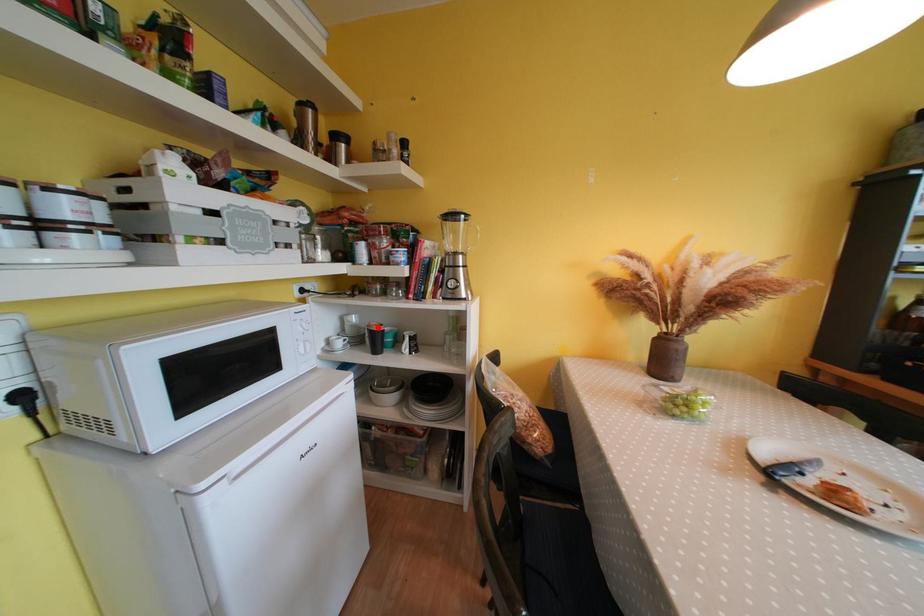
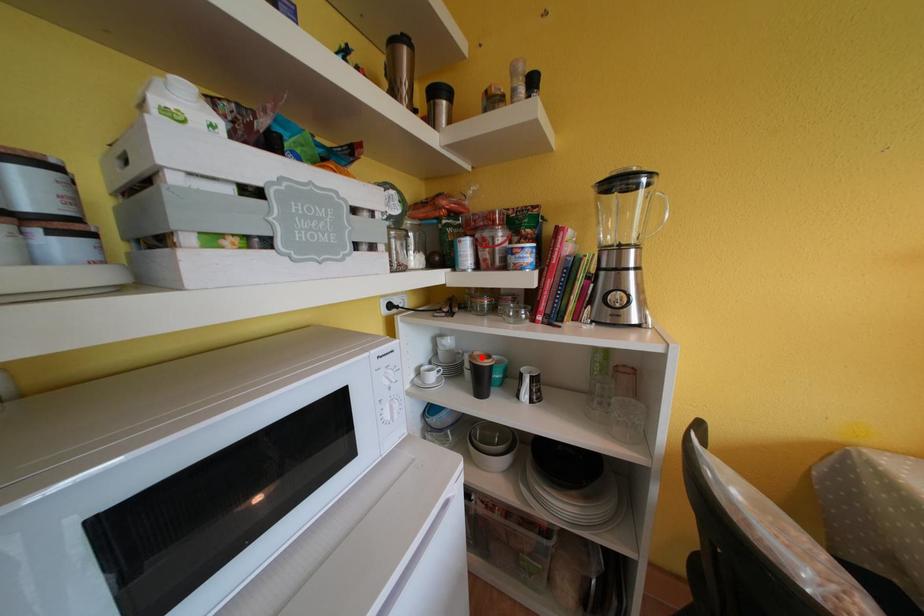
I am providing you with two images of the same scene from different viewpoints. A red point is marked on the first image and another point is marked on the second image. Is the red point in image1 aligned with the point shown in image2?

Yes